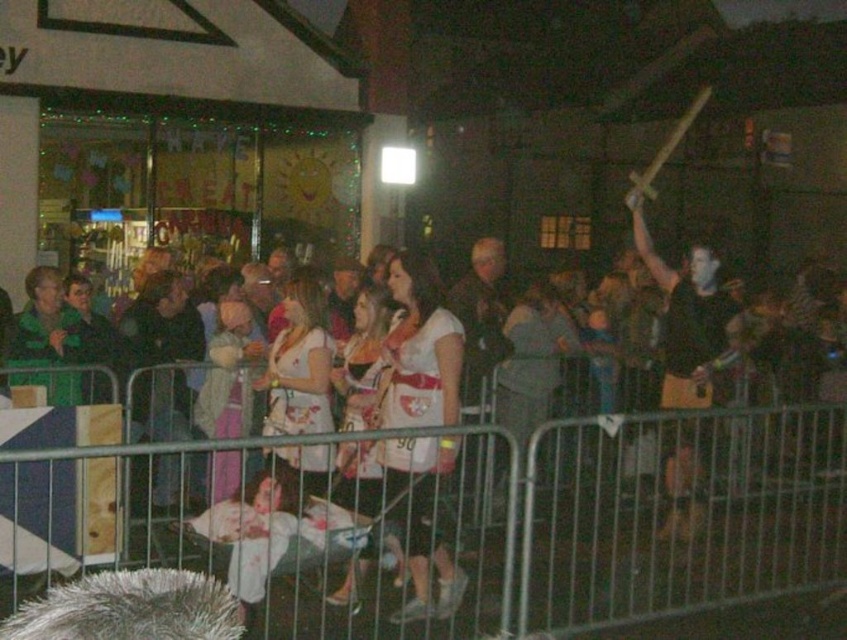
Question: Is metal at center smaller than white matte shirt at center?

Choices:
 (A) no
 (B) yes

Answer: (A)

Question: Which is farther from the black matte shirt at upper right?

Choices:
 (A) white matte shirt at center
 (B) metal at center

Answer: (A)

Question: Is white matte shirt at center above black matte shirt at upper right?

Choices:
 (A) no
 (B) yes

Answer: (A)

Question: Among these points, which one is farthest from the camera?

Choices:
 (A) (460, 326)
 (B) (779, 412)

Answer: (B)

Question: Among these points, which one is nearest to the camera?

Choices:
 (A) (678, 403)
 (B) (607, 604)

Answer: (B)

Question: Does metal at center come in front of black matte shirt at upper right?

Choices:
 (A) yes
 (B) no

Answer: (A)